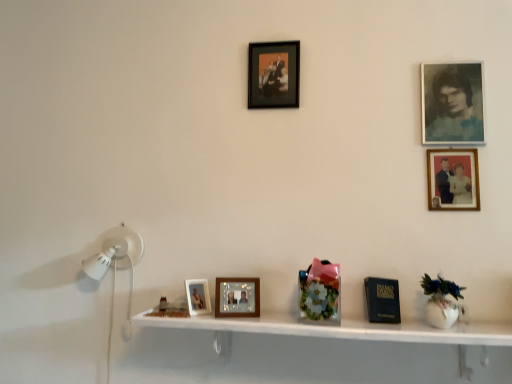
Question: Does point (195, 291) appear closer or farther from the camera than point (471, 137)?

Choices:
 (A) closer
 (B) farther

Answer: (A)

Question: Is matte wooden picture frame at center, the fifth picture frame when ordered from top to bottom, situated inside blue-toned paper photo frame at upper right, marked as the 1th picture frame in a right-to-left arrangement, or outside?

Choices:
 (A) inside
 (B) outside

Answer: (B)

Question: Estimate the real-world distances between objects in this image. Which object is farther from the wooden photo frame at center, the 4th picture frame when ordered from right to left?

Choices:
 (A) wooden picture frame at upper right, which is the second picture frame from right to left
 (B) white glossy shelf at lower center
 (C) matte wooden picture frame at center, which is the 5th picture frame in right-to-left order
 (D) floral-patterned glass vase at center
 (E) blue-toned paper photo frame at upper right, the fourth picture frame in the bottom-to-top sequence

Answer: (E)

Question: Which object is positioned closest to the wooden picture frame at upper right, which is the second picture frame from right to left?

Choices:
 (A) wooden photo frame at center, the second picture frame in the left-to-right sequence
 (B) floral-patterned glass vase at center
 (C) matte black picture frame at upper center, the 3th picture frame when ordered from left to right
 (D) matte wooden picture frame at center, the 1th picture frame positioned from the bottom
 (E) blue-toned paper photo frame at upper right, marked as the 1th picture frame in a right-to-left arrangement

Answer: (E)